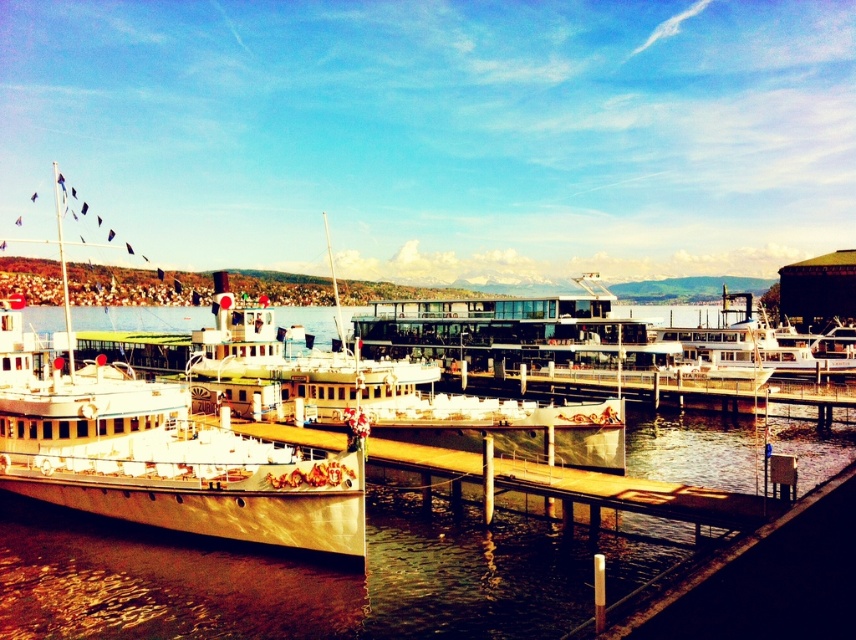
Question: Which object is closer to the camera taking this photo?

Choices:
 (A) metallic water at center
 (B) metallic gold boat at left

Answer: (A)

Question: Does metallic water at center lie in front of metallic gold boat at left?

Choices:
 (A) no
 (B) yes

Answer: (B)

Question: Which point appears farthest from the camera in this image?

Choices:
 (A) tap(339, 493)
 (B) tap(642, 419)

Answer: (B)

Question: Is metallic water at center thinner than metallic gold boat at left?

Choices:
 (A) yes
 (B) no

Answer: (B)

Question: Does metallic water at center appear over metallic gold boat at left?

Choices:
 (A) no
 (B) yes

Answer: (B)